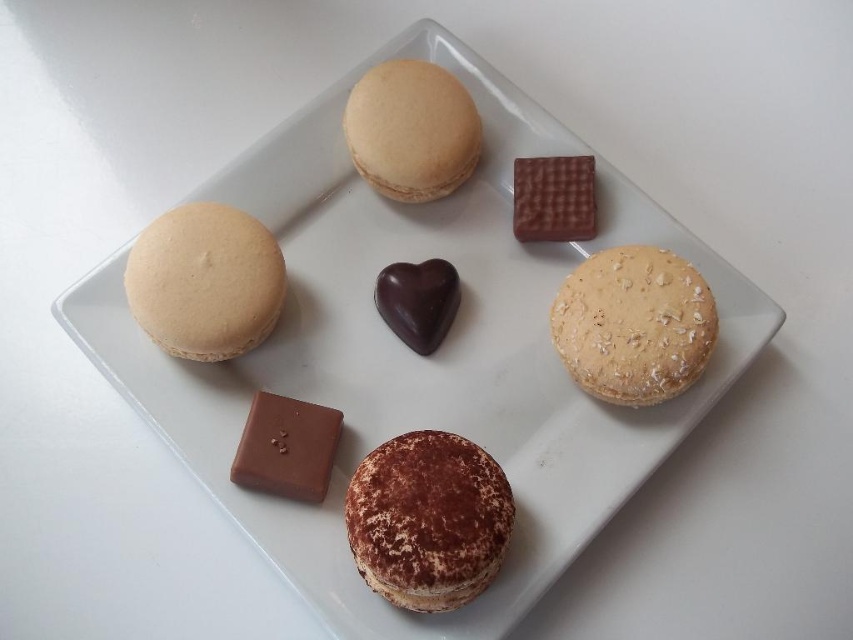
Describe the element at coordinates (410, 131) in the screenshot. I see `matte beige macaron at upper center` at that location.

Is point (412, 179) in front of point (282, 449)?

That is False.

What are the coordinates of `matte beige macaron at upper center` in the screenshot? It's located at (410, 131).

Can you confirm if smooth brown chocolate bar at bottom left is positioned to the left of smooth dark chocolate at upper center?

Indeed, smooth brown chocolate bar at bottom left is positioned on the left side of smooth dark chocolate at upper center.

Does smooth brown chocolate bar at bottom left appear on the right side of smooth dark chocolate at upper center?

In fact, smooth brown chocolate bar at bottom left is to the left of smooth dark chocolate at upper center.

Where is `smooth brown chocolate bar at bottom left`? smooth brown chocolate bar at bottom left is located at coordinates (286, 448).

Can you confirm if matte beige macaron at upper left is positioned to the left of smooth brown chocolate bar at bottom left?

Indeed, matte beige macaron at upper left is positioned on the left side of smooth brown chocolate bar at bottom left.

In the scene shown: Between matte beige macaron at upper left and smooth brown chocolate bar at bottom left, which one is positioned higher?

matte beige macaron at upper left is higher up.

Between point (236, 256) and point (312, 436), which one is positioned behind?

The point (236, 256) is behind.

Find the location of a particular element. Image resolution: width=853 pixels, height=640 pixels. matte beige macaron at upper left is located at coordinates (206, 282).